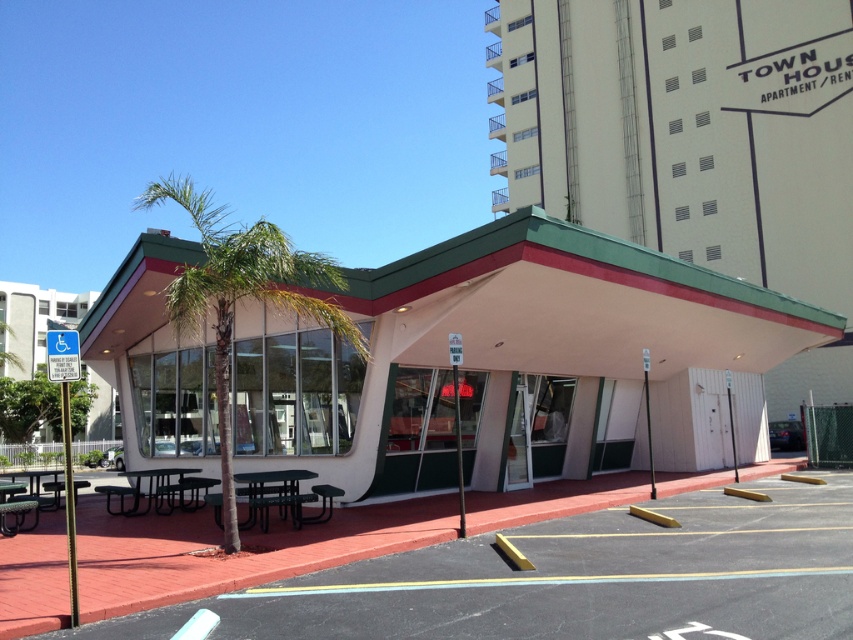
Question: Does beige/white textured hotel at center appear on the left side of white plastic sign at left?

Choices:
 (A) yes
 (B) no

Answer: (B)

Question: Among these objects, which one is farthest from the camera?

Choices:
 (A) matte white diner at center
 (B) green plastic picnic table at center
 (C) white plastic sign at left

Answer: (C)

Question: Which object is farther from the camera taking this photo?

Choices:
 (A) black metal picnic table at center
 (B) green plastic picnic table at center
 (C) green leafy palm tree at center
 (D) white plastic sign at left

Answer: (D)

Question: Does beige/white textured hotel at center come in front of black metal picnic table at center?

Choices:
 (A) no
 (B) yes

Answer: (A)

Question: Which point appears farthest from the camera in this image?

Choices:
 (A) (96, 406)
 (B) (509, 400)

Answer: (A)

Question: Can you confirm if matte white diner at center is positioned below green leafy palm tree at center?

Choices:
 (A) no
 (B) yes

Answer: (B)